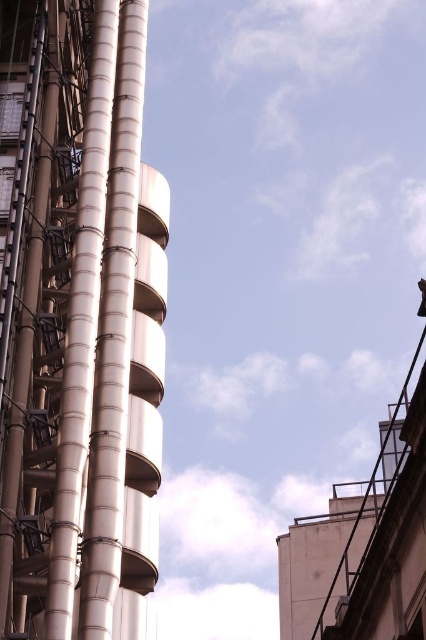
Question: Can you confirm if polished silver tower at left is positioned above sleek metallic spiral at center?

Choices:
 (A) yes
 (B) no

Answer: (B)

Question: Considering the relative positions of sleek metallic spiral at center and metallic silver pipes at center in the image provided, where is sleek metallic spiral at center located with respect to metallic silver pipes at center?

Choices:
 (A) left
 (B) right

Answer: (B)

Question: Among these points, which one is nearest to the camera?

Choices:
 (A) (62, 509)
 (B) (66, 470)
 (C) (126, 12)

Answer: (A)

Question: Which object is closer to the camera taking this photo?

Choices:
 (A) polished silver tower at left
 (B) metallic silver pipes at center

Answer: (A)

Question: Is polished silver tower at left below sleek metallic spiral at center?

Choices:
 (A) yes
 (B) no

Answer: (A)

Question: Which object appears farthest from the camera in this image?

Choices:
 (A) polished silver tower at left
 (B) metallic silver pipes at center

Answer: (B)